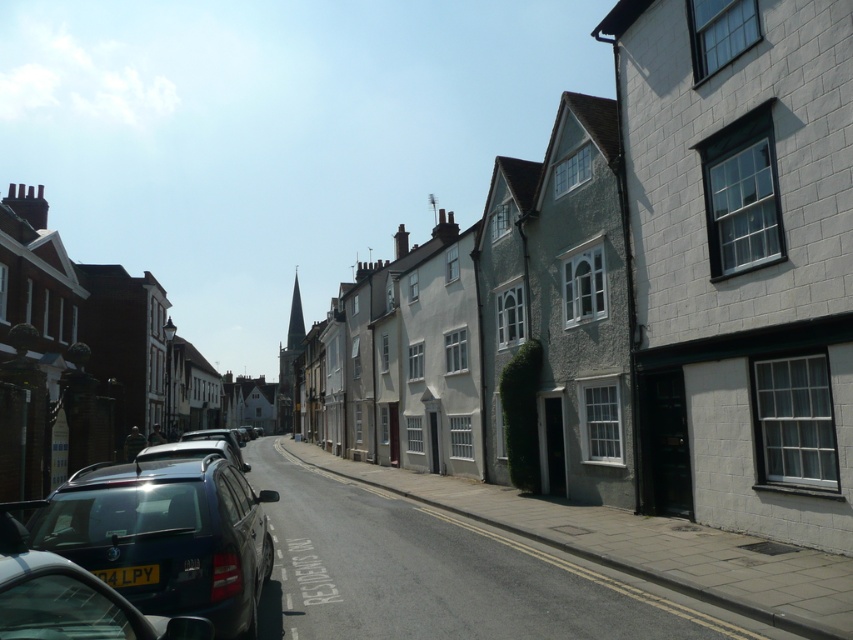
Question: Which of the following is the farthest from the observer?

Choices:
 (A) shiny dark blue suv at lower left
 (B) white brick building at center

Answer: (B)

Question: Is the position of white brick building at center more distant than that of shiny dark blue suv at lower left?

Choices:
 (A) yes
 (B) no

Answer: (A)

Question: Does white brick building at center appear under shiny dark blue suv at lower left?

Choices:
 (A) yes
 (B) no

Answer: (B)

Question: Can you confirm if white brick building at center is positioned to the left of shiny dark blue suv at lower left?

Choices:
 (A) no
 (B) yes

Answer: (A)

Question: Which object is closer to the camera taking this photo?

Choices:
 (A) shiny dark blue suv at lower left
 (B) white brick building at center

Answer: (A)